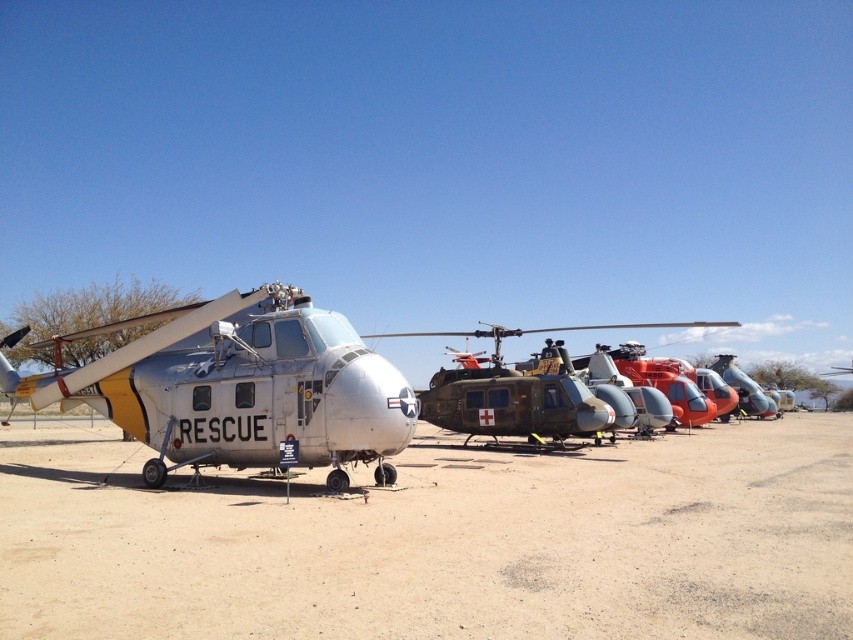
You are standing at the edge of the dirt field at center and want to walk to the metallic green helicopter at center. Which direction should you head towards?

Since the dirt field at center is to the left of the metallic green helicopter at center, you should head towards the right to reach the metallic green helicopter at center.

You are a pilot standing near the silver metallic helicopter at center and the metallic green helicopter at center. You want to walk directly to the nearest helicopter that is closer to you. Which helicopter should you choose?

You should choose the silver metallic helicopter at center because it is closer to you than the metallic green helicopter at center.